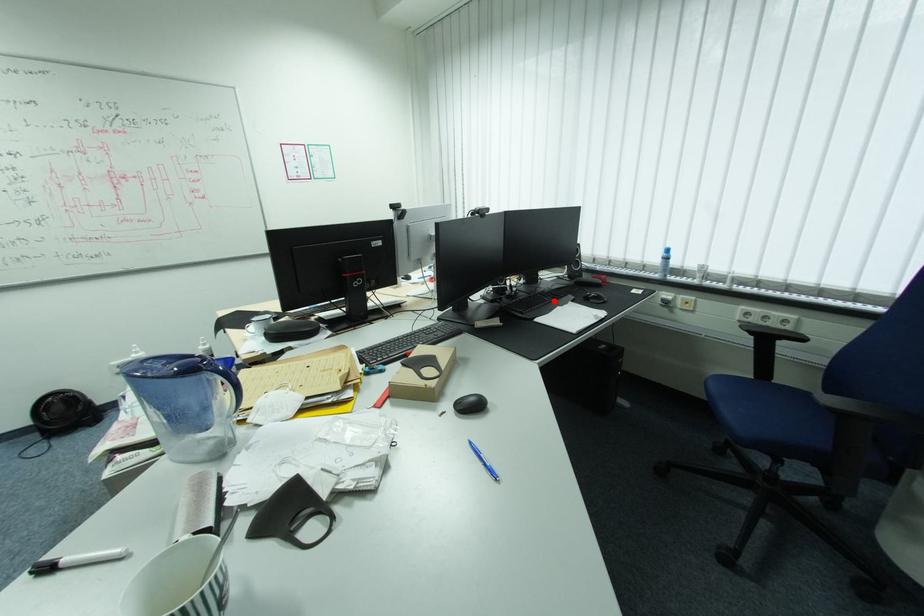
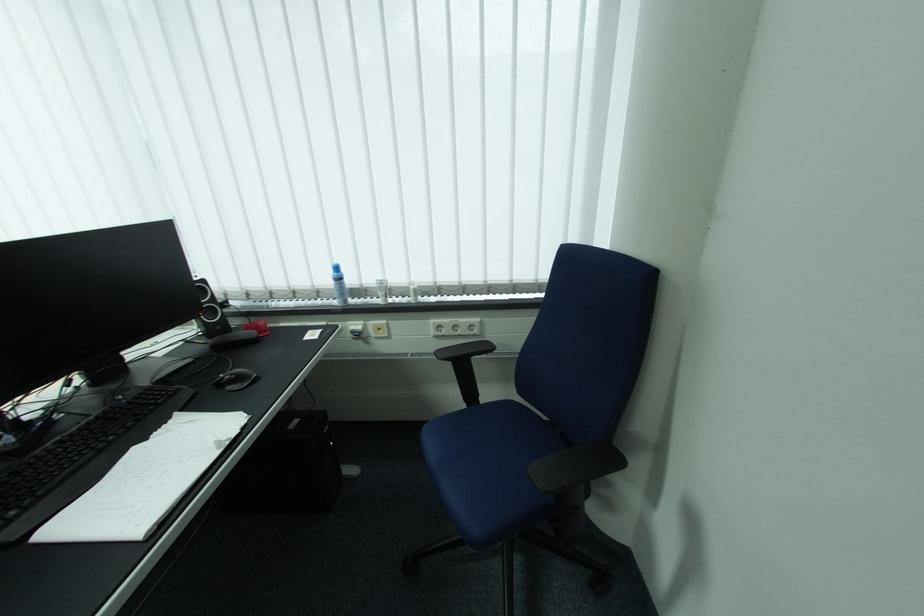
In the second image, find the point that corresponds to the highlighted location in the first image.

(117, 438)